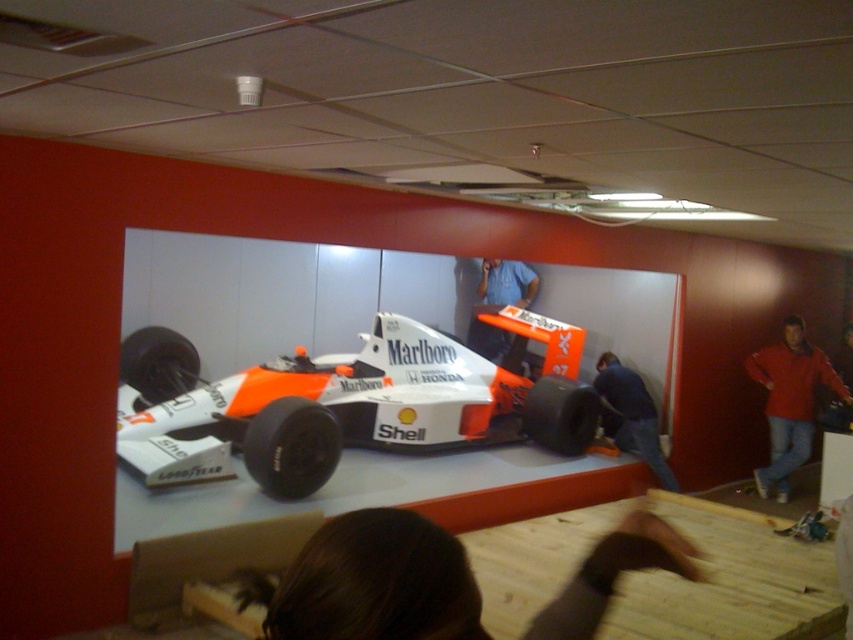
Does white matte race car at center appear on the right side of dark blue fabric at lower center?

Incorrect, white matte race car at center is not on the right side of dark blue fabric at lower center.

Can you confirm if white matte race car at center is thinner than dark blue fabric at lower center?

Incorrect, white matte race car at center's width is not less than dark blue fabric at lower center's.

Identify the location of white matte race car at center. Image resolution: width=853 pixels, height=640 pixels. (364, 404).

Who is more distant from viewer, (335, 545) or (527, 282)?

The point (527, 282) is more distant.

Consider the image. Who is positioned more to the right, brown hair at lower center or blue fabric shirt at center?

blue fabric shirt at center

Where is `brown hair at lower center`? The height and width of the screenshot is (640, 853). brown hair at lower center is located at coordinates (376, 582).

Between brown hair at lower center and dark blue fabric at lower center, which one has more height?

dark blue fabric at lower center

Does brown hair at lower center have a lesser width compared to dark blue fabric at lower center?

Yes.

Image resolution: width=853 pixels, height=640 pixels. What do you see at coordinates (376, 582) in the screenshot? I see `brown hair at lower center` at bounding box center [376, 582].

I want to click on brown hair at lower center, so click(376, 582).